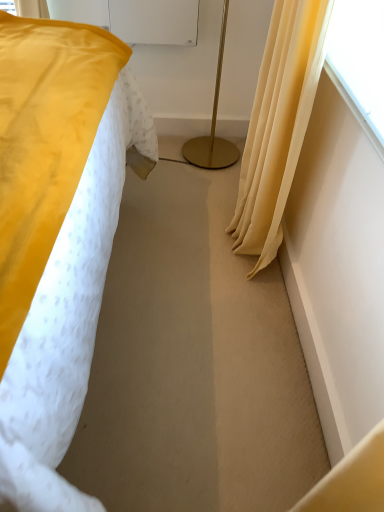
Question: Does gold metallic floor lamp at center appear on the left side of transparent plastic screen at upper right?

Choices:
 (A) no
 (B) yes

Answer: (B)

Question: Does gold metallic floor lamp at center have a greater height compared to transparent plastic screen at upper right?

Choices:
 (A) no
 (B) yes

Answer: (B)

Question: From a real-world perspective, is gold metallic floor lamp at center positioned under transparent plastic screen at upper right based on gravity?

Choices:
 (A) yes
 (B) no

Answer: (A)

Question: Is gold metallic floor lamp at center turned away from transparent plastic screen at upper right?

Choices:
 (A) yes
 (B) no

Answer: (B)

Question: From the image's perspective, is gold metallic floor lamp at center below transparent plastic screen at upper right?

Choices:
 (A) no
 (B) yes

Answer: (A)

Question: From a real-world perspective, is gold metallic floor lamp at center positioned over transparent plastic screen at upper right based on gravity?

Choices:
 (A) no
 (B) yes

Answer: (A)

Question: Does transparent plastic screen at upper right turn towards gold metallic floor lamp at center?

Choices:
 (A) no
 (B) yes

Answer: (A)

Question: Can you confirm if transparent plastic screen at upper right is positioned to the right of gold metallic floor lamp at center?

Choices:
 (A) yes
 (B) no

Answer: (A)

Question: Can you confirm if transparent plastic screen at upper right is shorter than gold metallic floor lamp at center?

Choices:
 (A) no
 (B) yes

Answer: (B)

Question: From a real-world perspective, is transparent plastic screen at upper right physically above gold metallic floor lamp at center?

Choices:
 (A) no
 (B) yes

Answer: (B)

Question: From the image's perspective, is transparent plastic screen at upper right under gold metallic floor lamp at center?

Choices:
 (A) no
 (B) yes

Answer: (B)

Question: Can we say transparent plastic screen at upper right lies outside gold metallic floor lamp at center?

Choices:
 (A) yes
 (B) no

Answer: (A)

Question: Is matte yellow curtain at right further to the viewer compared to transparent plastic screen at upper right?

Choices:
 (A) no
 (B) yes

Answer: (B)